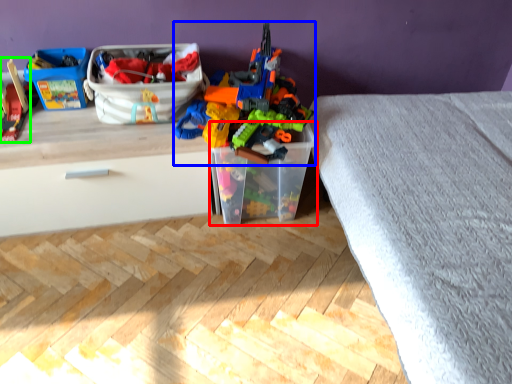
Question: Considering the real-world distances, which object is farthest from storage box (highlighted by a red box)? toy (highlighted by a blue box) or toy (highlighted by a green box)?

Choices:
 (A) toy
 (B) toy

Answer: (B)